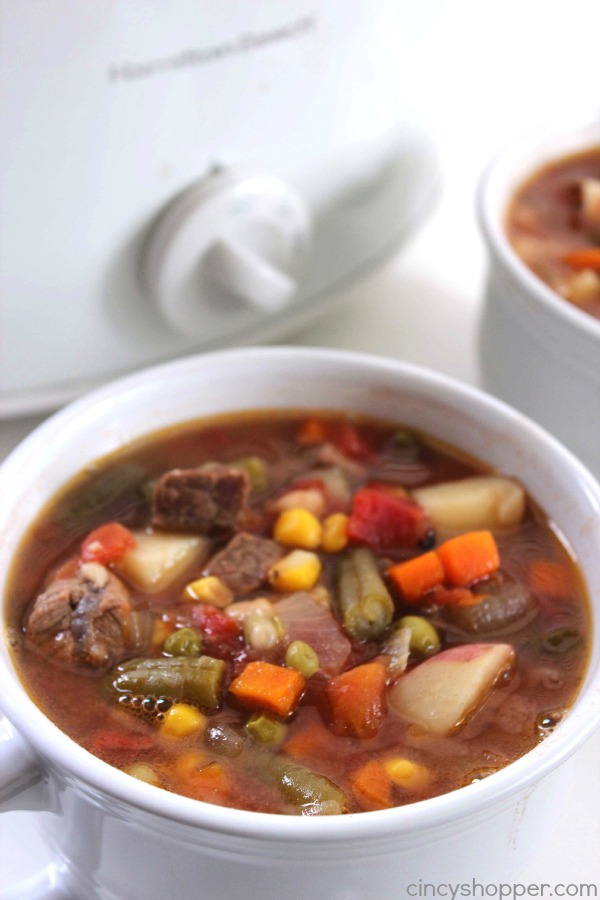
Image resolution: width=600 pixels, height=900 pixels. I want to click on white pot, so click(x=411, y=822), click(x=541, y=311).